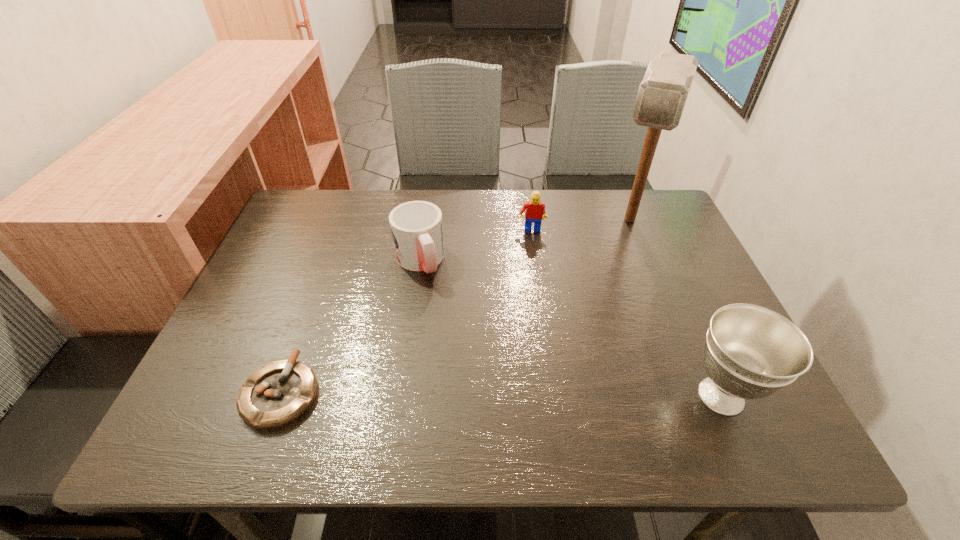
The height and width of the screenshot is (540, 960). In the image, there is a desktop. Find the location of `free region at the left edge`. free region at the left edge is located at coordinates (256, 318).

Locate an element on the screen. free space at the right edge of the desktop is located at coordinates (684, 278).

This screenshot has width=960, height=540. I want to click on vacant region at the far left corner of the desktop, so click(x=316, y=208).

In the image, there is a desktop. Find the location of `vacant area at the far right corner`. vacant area at the far right corner is located at coordinates (658, 201).

I want to click on free area in between the Lego and the second tallest object, so click(x=626, y=313).

Find the location of `vacant area that lies between the mug and the third object from left to right`. vacant area that lies between the mug and the third object from left to right is located at coordinates (475, 246).

At what (x,y) coordinates should I click in order to perform the action: click on vacant space that is in between the mug and the second tallest object. Please return your answer as a coordinate pair (x, y). Looking at the image, I should click on (570, 328).

Where is `vacant point located between the mug and the leftmost object`? The width and height of the screenshot is (960, 540). vacant point located between the mug and the leftmost object is located at coordinates (350, 327).

Identify the location of vacant area that lies between the mug and the chalice. Image resolution: width=960 pixels, height=540 pixels. (570, 328).

You are a GUI agent. You are given a task and a screenshot of the screen. Output one action in this format:
    pyautogui.click(x=<x>, y=<y>)
    Task: Click on the free area in between the mallet and the third object from left to right
    Image resolution: width=960 pixels, height=540 pixels.
    Given the screenshot: What is the action you would take?
    pyautogui.click(x=580, y=225)